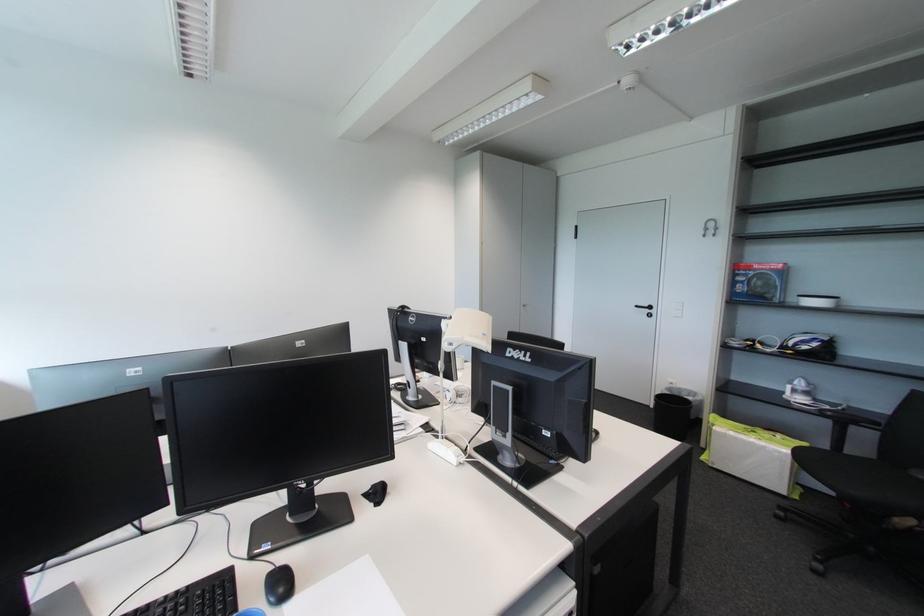
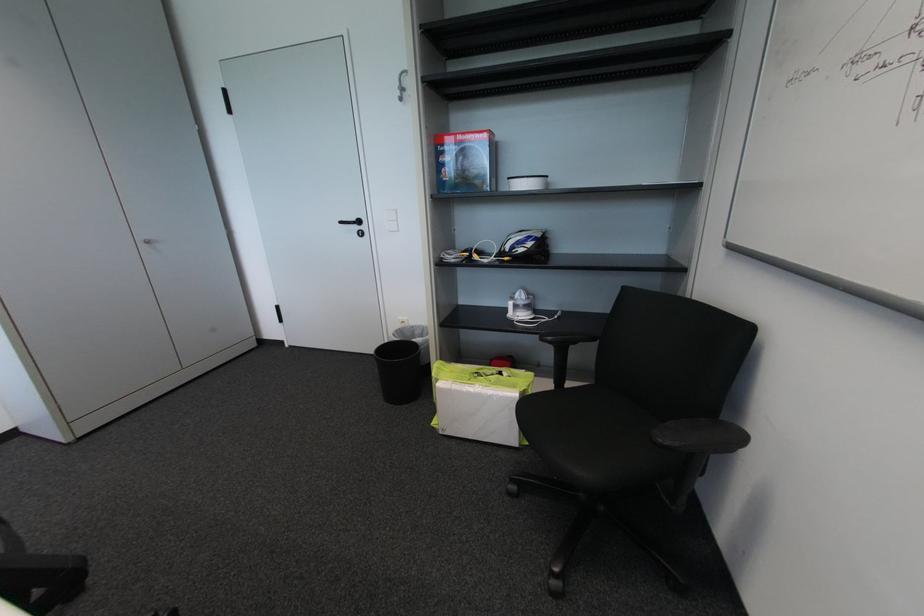
Find the pixel in the second image that matches [774,440] in the first image.

(501, 386)